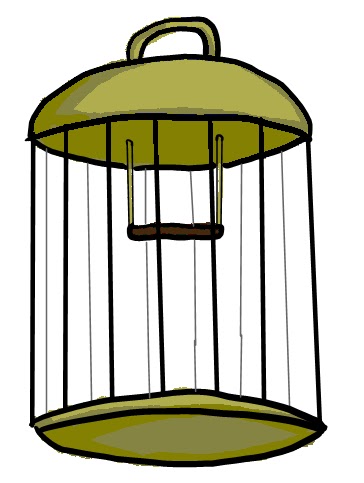
Find the location of a particular element. handle is located at coordinates (153, 29).